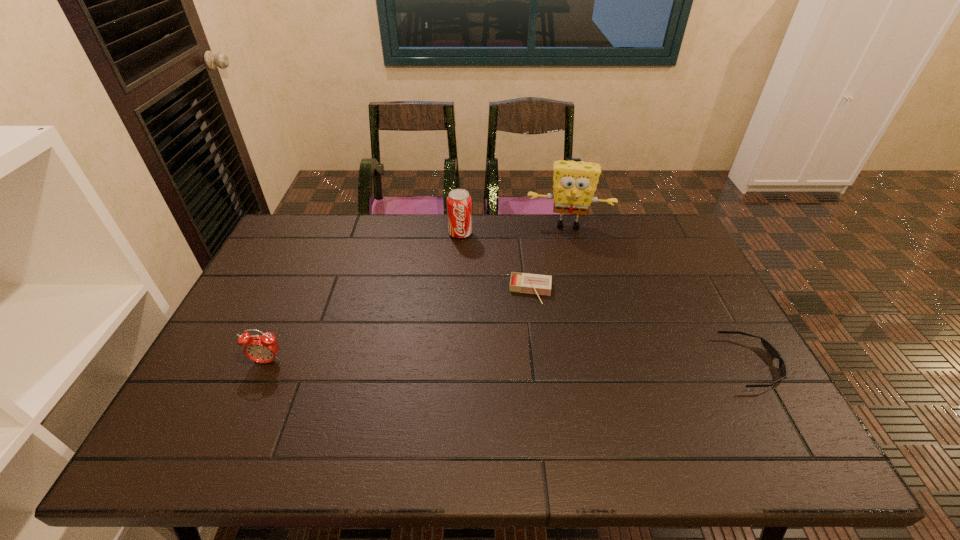
Identify which object is the second closest to the shortest object. Please provide its 2D coordinates. Your answer should be formatted as a tuple, i.e. [(x, y)], where the tuple contains the x and y coordinates of a point satisfying the conditions above.

[(574, 185)]

You are a GUI agent. You are given a task and a screenshot of the screen. Output one action in this format:
    pyautogui.click(x=<x>, y=<y>)
    Task: Click on the vacant position in the image that satisfies the following two spatial constraints: 1. on the face of the third tallest object; 2. on the front-facing side of the sunglasses
    The image size is (960, 540).
    Given the screenshot: What is the action you would take?
    pyautogui.click(x=267, y=363)

Where is `vacant region that satisfies the following two spatial constraints: 1. on the face of the third tallest object; 2. on the front-facing side of the shortest object`? vacant region that satisfies the following two spatial constraints: 1. on the face of the third tallest object; 2. on the front-facing side of the shortest object is located at coordinates (267, 363).

I want to click on vacant space that satisfies the following two spatial constraints: 1. on the face of the alarm clock; 2. on the front-facing side of the rightmost object, so click(267, 363).

Locate an element on the screen. This screenshot has width=960, height=540. vacant space that satisfies the following two spatial constraints: 1. on the face of the leftmost object; 2. on the front-facing side of the shortest object is located at coordinates (267, 363).

The image size is (960, 540). I want to click on blank area in the image that satisfies the following two spatial constraints: 1. on the face of the rightmost object; 2. on the front-facing side of the third shortest object, so click(267, 363).